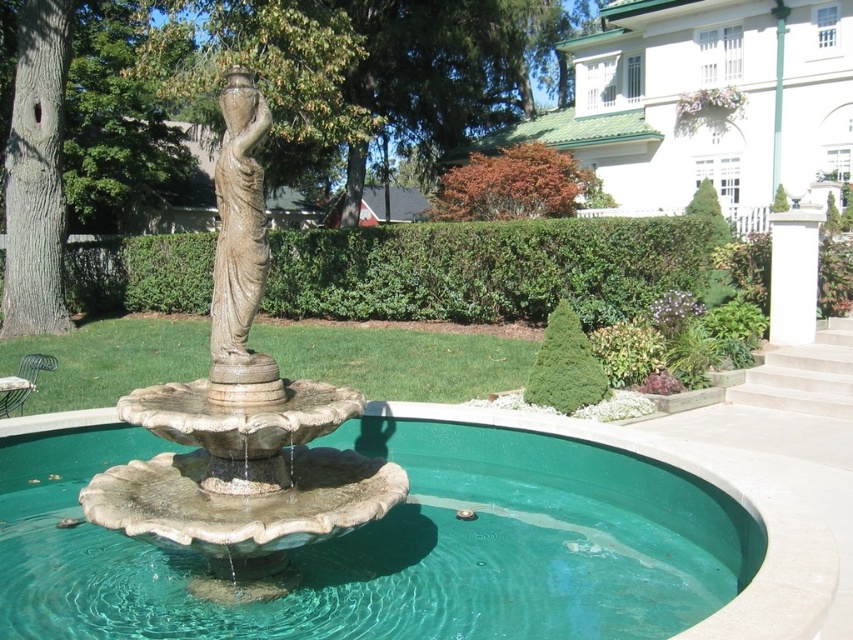
Can you confirm if clear glass pool at center is positioned below green leafy hedge at center?

Indeed, clear glass pool at center is positioned under green leafy hedge at center.

Can you confirm if clear glass pool at center is shorter than green leafy hedge at center?

Indeed, clear glass pool at center has a lesser height compared to green leafy hedge at center.

Is point (408, 467) in front of point (421, 289)?

Yes, it is in front of point (421, 289).

Identify the location of clear glass pool at center. The width and height of the screenshot is (853, 640). (398, 545).

Does stone statue at center come in front of matte bronze statue at center?

Yes, stone statue at center is in front of matte bronze statue at center.

Looking at this image, can you confirm if stone statue at center is wider than matte bronze statue at center?

In fact, stone statue at center might be narrower than matte bronze statue at center.

Based on the photo, who is more forward, (171, 456) or (224, 208)?

Point (224, 208)

The image size is (853, 640). Identify the location of stone statue at center. (241, 419).

Based on the photo, which is more to the left, clear glass pool at center or matte bronze statue at center?

From the viewer's perspective, matte bronze statue at center appears more on the left side.

Consider the image. Does clear glass pool at center appear over matte bronze statue at center?

No, clear glass pool at center is not above matte bronze statue at center.

Find the location of a particular element. clear glass pool at center is located at coordinates [x=398, y=545].